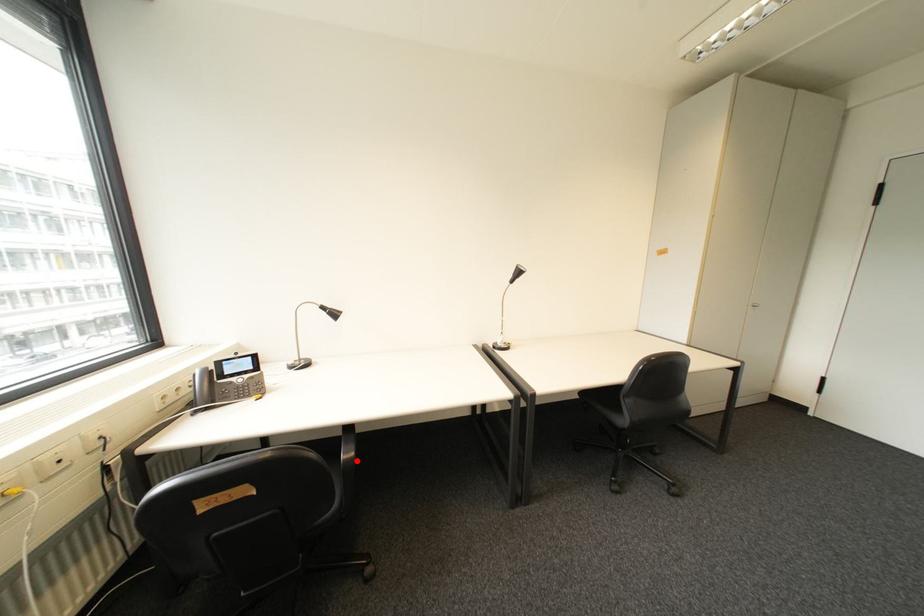
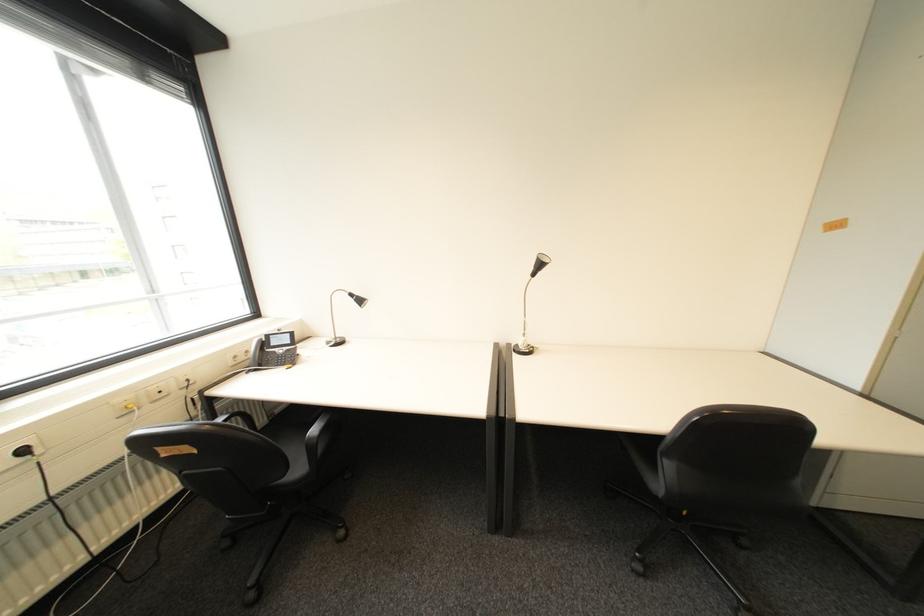
The point at the highlighted location is marked in the first image. Where is the corresponding point in the second image?

(321, 439)